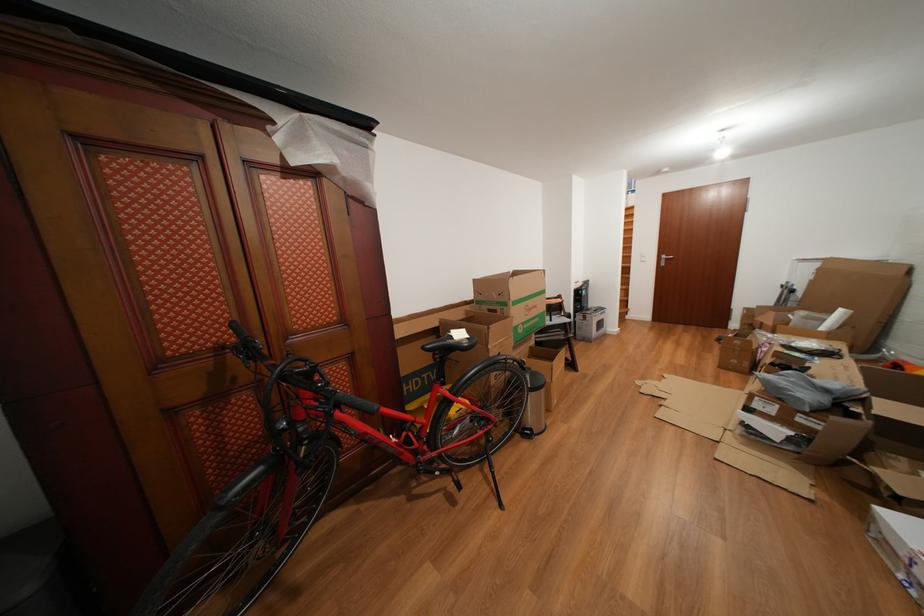
Find the location of `bicycle handlebar grip`. bicycle handlebar grip is located at coordinates (246, 345).